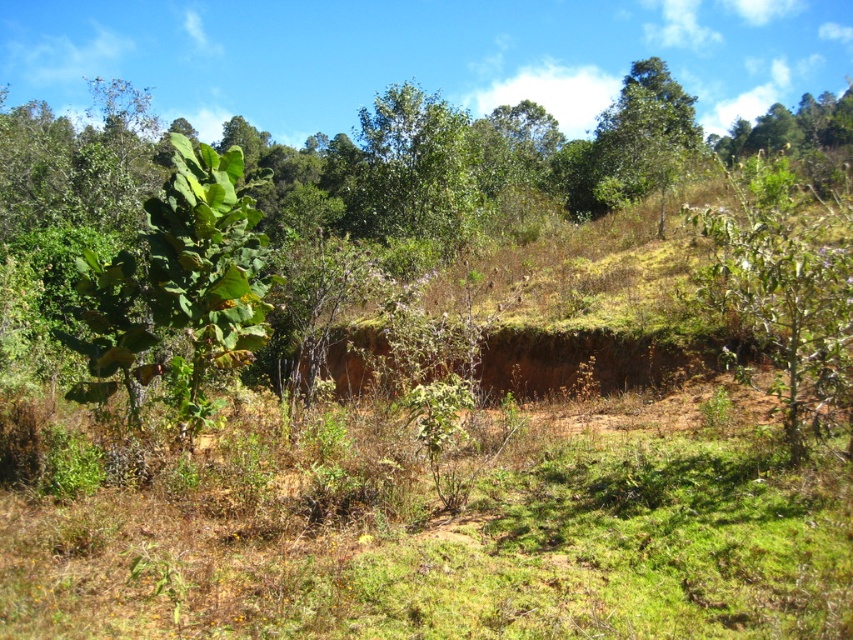
You are standing in the natural landscape and want to take a photo of the green leafy tree at center without the green leafy tree at upper center blocking it. How should you position yourself?

Move closer to the green leafy tree at center so that it comes forward in the frame, placing it in front of the green leafy tree at upper center, which is behind it. This way, the green leafy tree at center will be the main focus without obstruction.

You are standing at the point marked as point (413, 170) in the image. What object is directly in front of you?

The green leafy tree at center is directly in front of you at point (413, 170).